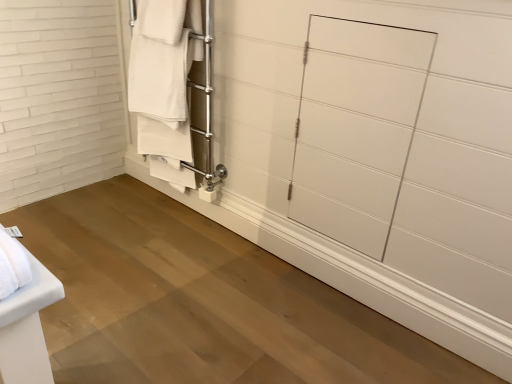
Image resolution: width=512 pixels, height=384 pixels. In order to click on white glossy door at center in this screenshot , I will do `click(355, 127)`.

In order to face white glossy door at center, should I rotate leftwards or rightwards?

It's best to rotate right around 12.570 degrees.

The image size is (512, 384). What do you see at coordinates (355, 127) in the screenshot?
I see `white glossy door at center` at bounding box center [355, 127].

Measure the distance between white glossy door at center and camera.

The depth of white glossy door at center is 1.36 meters.

Describe the element at coordinates (172, 90) in the screenshot. Image resolution: width=512 pixels, height=384 pixels. I see `white matte towel rack at upper left` at that location.

The height and width of the screenshot is (384, 512). Identify the location of white matte towel rack at upper left. (172, 90).

This screenshot has height=384, width=512. I want to click on white glossy door at center, so click(355, 127).

Based on their positions, is white glossy door at center located to the left or right of white matte towel rack at upper left?

From the image, it's evident that white glossy door at center is to the right of white matte towel rack at upper left.

Looking at this image, considering their positions, is white glossy door at center located in front of or behind white matte towel rack at upper left?

white glossy door at center is in front of white matte towel rack at upper left.

Is point (378, 232) in front of point (170, 129)?

That is True.

From the image's perspective, which is above, white glossy door at center or white matte towel rack at upper left?

white matte towel rack at upper left appears higher in the image.

From a real-world perspective, who is located lower, white glossy door at center or white matte towel rack at upper left?

In real-world perspective, white glossy door at center is lower.

Between white glossy door at center and white matte towel rack at upper left, which one has smaller width?

white glossy door at center is thinner.

Is white glossy door at center shorter than white matte towel rack at upper left?

Correct, white glossy door at center is not as tall as white matte towel rack at upper left.

Considering the sizes of objects white glossy door at center and white matte towel rack at upper left in the image provided, who is smaller, white glossy door at center or white matte towel rack at upper left?

With smaller size is white glossy door at center.

In the scene shown: Is white glossy door at center surrounding white matte towel rack at upper left?

No, white matte towel rack at upper left is not surrounded by white glossy door at center.

Are white glossy door at center and white matte towel rack at upper left far apart?

Actually, white glossy door at center and white matte towel rack at upper left are a little close together.

Is white glossy door at center looking in the opposite direction of white matte towel rack at upper left?

No, white glossy door at center is not facing away from white matte towel rack at upper left.

This screenshot has width=512, height=384. Identify the location of closet located on the left of white glossy door at center. (172, 90).

Considering the positions of objects white matte towel rack at upper left and white glossy door at center in the image provided, who is more to the left, white matte towel rack at upper left or white glossy door at center?

Positioned to the left is white matte towel rack at upper left.

In the image, is white matte towel rack at upper left positioned in front of or behind white glossy door at center?

In the image, white matte towel rack at upper left appears behind white glossy door at center.

Does point (183, 29) appear closer or farther from the camera than point (369, 67)?

Clearly, point (183, 29) is more distant from the camera than point (369, 67).

Consider the image. From the image's perspective, is white matte towel rack at upper left on top of white glossy door at center?

Yes.

From a real-world perspective, who is located lower, white matte towel rack at upper left or white glossy door at center?

white glossy door at center.

Which object is thinner, white matte towel rack at upper left or white glossy door at center?

Thinner between the two is white glossy door at center.

Between white matte towel rack at upper left and white glossy door at center, which one has more height?

Standing taller between the two is white matte towel rack at upper left.

Considering the sizes of objects white matte towel rack at upper left and white glossy door at center in the image provided, who is bigger, white matte towel rack at upper left or white glossy door at center?

white matte towel rack at upper left is bigger.

Could white glossy door at center be considered to be inside white matte towel rack at upper left?

No.

Is white matte towel rack at upper left not near white glossy door at center?

No, white matte towel rack at upper left is not far from white glossy door at center.

Is white matte towel rack at upper left positioned with its back to white glossy door at center?

white matte towel rack at upper left does not have its back to white glossy door at center.

Can you tell me how much white matte towel rack at upper left and white glossy door at center differ in facing direction?

There is a 0.769-degree angle between the facing directions of white matte towel rack at upper left and white glossy door at center.

Identify the location of closet that is above the white glossy door at center (from the image's perspective). (172, 90).

This screenshot has height=384, width=512. Identify the location of glass door to the right of white matte towel rack at upper left. (355, 127).

At what (x,y) coordinates should I click in order to perform the action: click on closet behind the white glossy door at center. Please return your answer as a coordinate pair (x, y). The image size is (512, 384). Looking at the image, I should click on (172, 90).